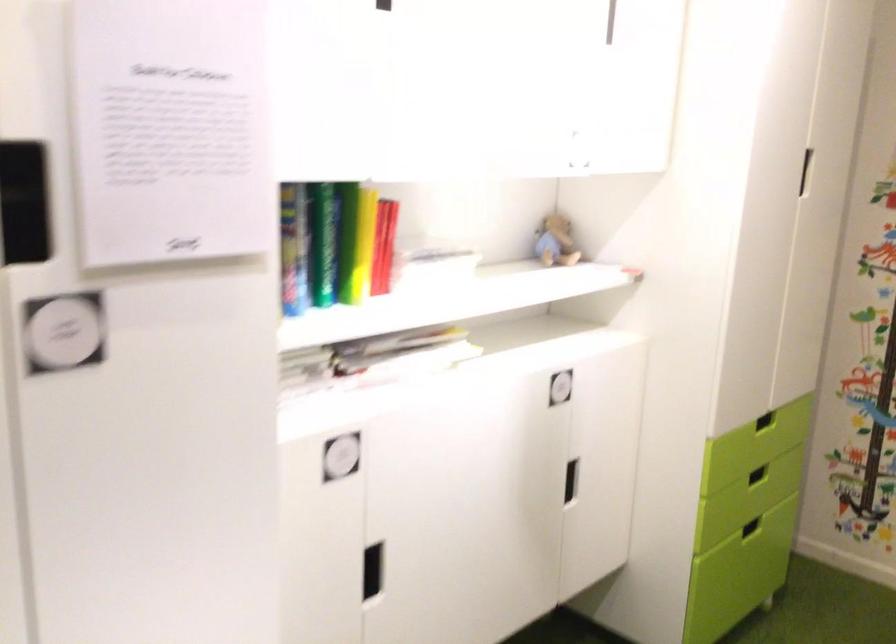
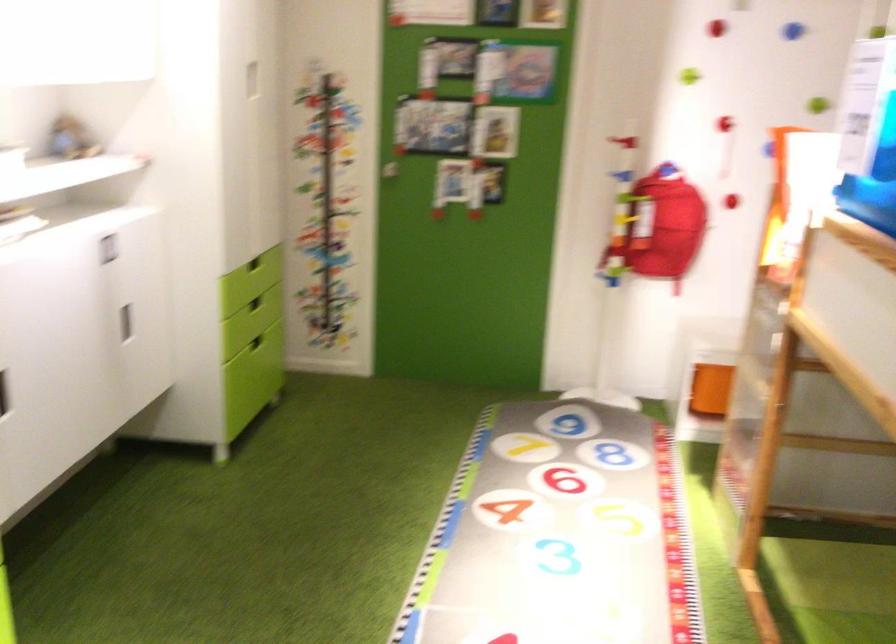
In the second image, find the point that corresponds to the point at 754,527 in the first image.

(255, 342)